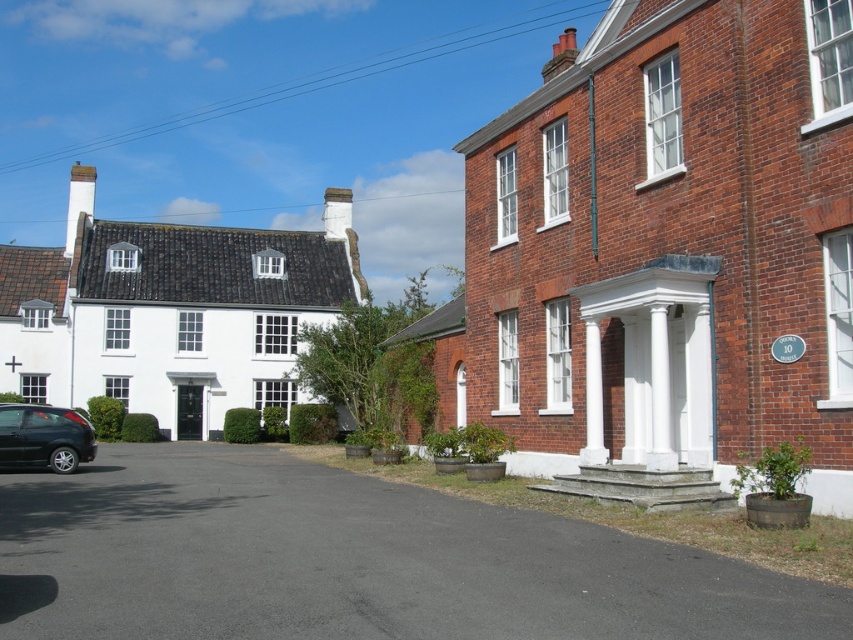
You are a delivery driver arriving at the buildings and need to park your vehicle. The shiny black car at lower left is blocking the entrance to the black asphalt driveway at lower left. Can you maneuver around it to access the driveway?

The black asphalt driveway at lower left is to the right of the shiny black car at lower left, so you can drive around the car on its right side to access the driveway.